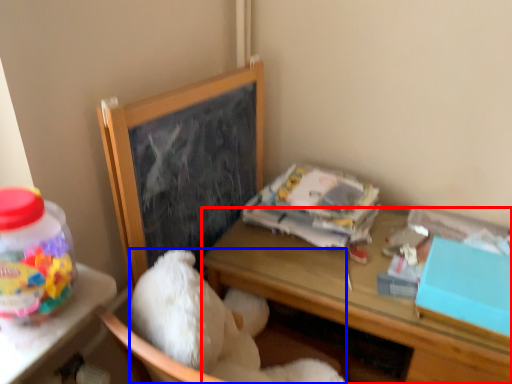
Question: Which point is closer to the camera, desk (highlighted by a red box) or teddy bear (highlighted by a blue box)?

Choices:
 (A) desk
 (B) teddy bear

Answer: (B)